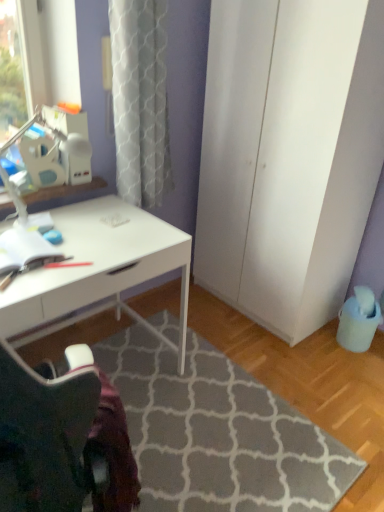
Question: Is gray textured rug at lower center wider or thinner than white matte cabinet at right?

Choices:
 (A) wide
 (B) thin

Answer: (A)

Question: From the image's perspective, relative to white matte cabinet at right, is gray textured rug at lower center above or below?

Choices:
 (A) below
 (B) above

Answer: (A)

Question: Which object is positioned closest to the white matte cabinet at right?

Choices:
 (A) white glossy desk at center
 (B) gray textured rug at lower center

Answer: (A)

Question: Which object is the closest to the white glossy desk at center?

Choices:
 (A) white matte cabinet at right
 (B) gray textured rug at lower center

Answer: (B)